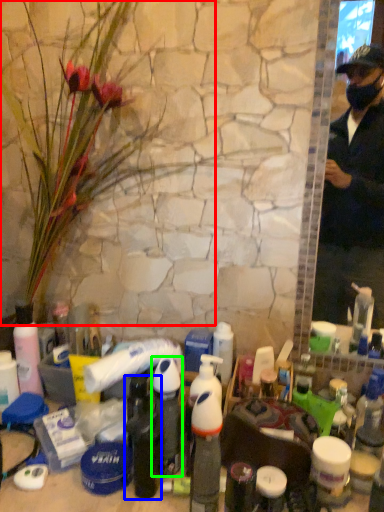
Question: Which object is the farthest from flower (highlighted by a red box)? Choose among these: bottle (highlighted by a blue box) or bottle (highlighted by a green box).

Choices:
 (A) bottle
 (B) bottle

Answer: (A)